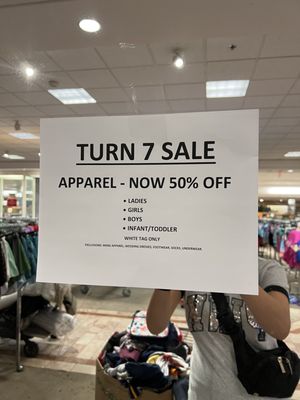
You are a GUI agent. You are given a task and a screenshot of the screen. Output one action in this format:
    pyautogui.click(x=<x>, y=<y>)
    Task: Click on the tile floor
    
    Given the screenshot: What is the action you would take?
    pyautogui.click(x=88, y=339)